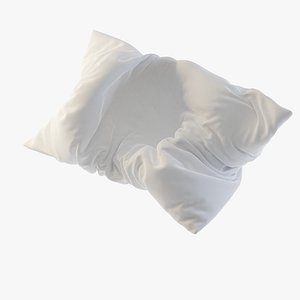
Image resolution: width=300 pixels, height=300 pixels. In order to click on upper left corner of the pillow in this screenshot , I will do `click(96, 32)`.